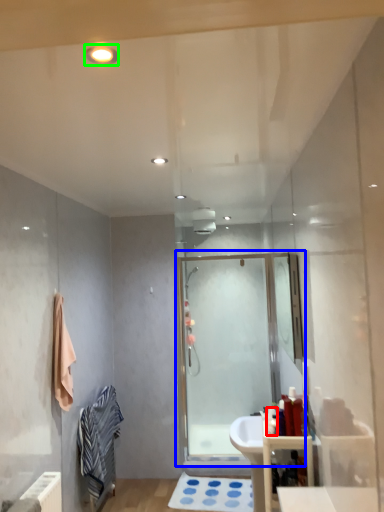
Question: Which is nearer to the toiletry (highlighted by a red box)? screen door (highlighted by a blue box) or light fixture (highlighted by a green box).

Choices:
 (A) screen door
 (B) light fixture

Answer: (A)